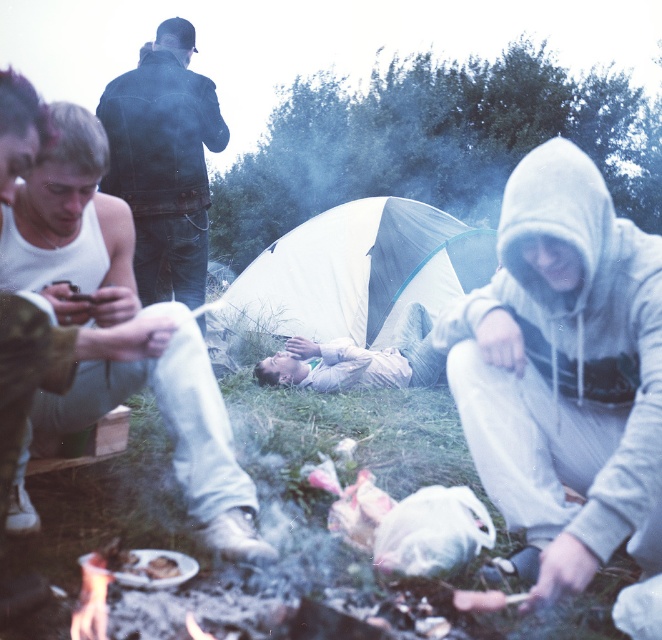
Question: Which point is farther from the camera taking this photo?

Choices:
 (A) (363, 376)
 (B) (148, 202)
 (C) (657, 484)

Answer: (A)

Question: Can you confirm if light gray hoodie at lower right is positioned to the left of white fabric tent at center?

Choices:
 (A) no
 (B) yes

Answer: (A)

Question: Which object is farther from the camera taking this photo?

Choices:
 (A) light gray hoodie at lower right
 (B) white fabric tent at center

Answer: (B)

Question: Is white cotton tank top at left wider than white fabric tent at center?

Choices:
 (A) yes
 (B) no

Answer: (B)

Question: Which object appears closest to the camera in this image?

Choices:
 (A) dark blue leather jacket at upper left
 (B) white fabric tent at center

Answer: (A)

Question: Is light gray hoodie at lower right bigger than light gray hoodie at center?

Choices:
 (A) no
 (B) yes

Answer: (A)